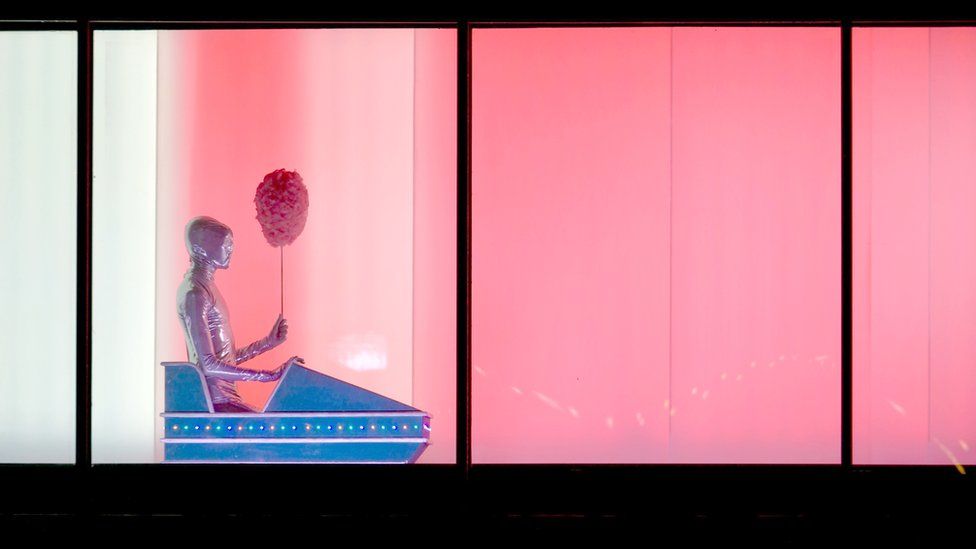
The image size is (976, 549). Find the location of `lights`. lights is located at coordinates (306, 424).